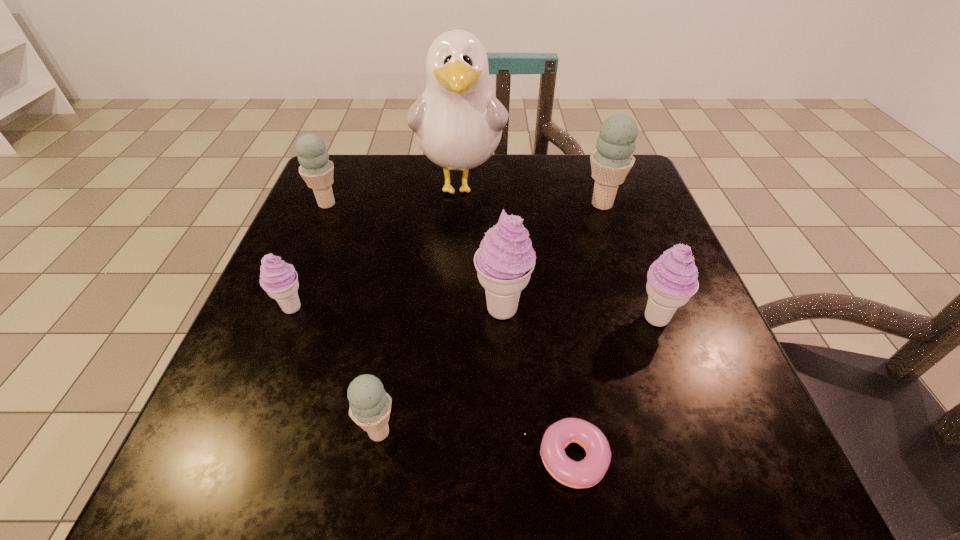
What are the coordinates of `the shortest object` in the screenshot? It's located at (586, 473).

You are a GUI agent. You are given a task and a screenshot of the screen. Output one action in this format:
    pyautogui.click(x=<x>, y=<y>)
    Task: Click on the purple doughnut
    This screenshot has height=540, width=960.
    Given the screenshot: What is the action you would take?
    coord(586,473)

Image resolution: width=960 pixels, height=540 pixels. I want to click on free space located 0.270m on the beak of the white gull, so click(x=453, y=315).

The image size is (960, 540). In order to click on free space located 0.340m on the front of the rightmost blue ice cream in this screenshot , I will do `click(648, 342)`.

Image resolution: width=960 pixels, height=540 pixels. In order to click on vacant space positioned 0.210m on the left of the third ice cream from right to left in this screenshot , I will do `click(356, 309)`.

This screenshot has width=960, height=540. I want to click on free region located 0.160m on the right of the second smallest blue ice cream, so (414, 204).

At what (x,y) coordinates should I click in order to perform the action: click on free spot located 0.170m on the back of the rightmost purple icecream. Please return your answer as a coordinate pair (x, y). Image resolution: width=960 pixels, height=540 pixels. Looking at the image, I should click on (628, 240).

Where is `vacant space positioned on the front of the leftmost purple icecream`? The width and height of the screenshot is (960, 540). vacant space positioned on the front of the leftmost purple icecream is located at coordinates coord(245,424).

Identify the location of free spot located on the right of the smallest blue ice cream. (533, 432).

The width and height of the screenshot is (960, 540). What are the coordinates of `blank area located 0.210m on the right of the purple doughnut` in the screenshot? It's located at (763, 458).